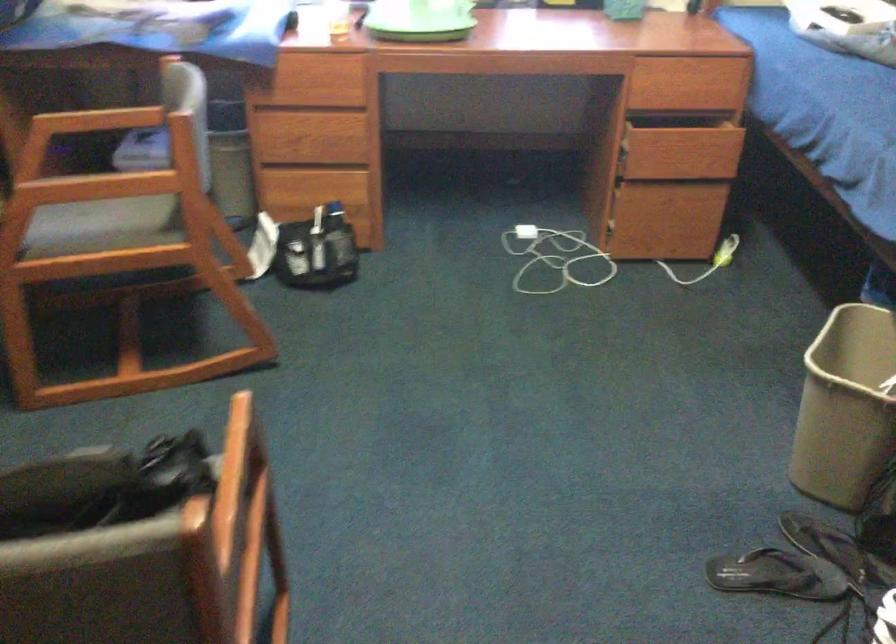
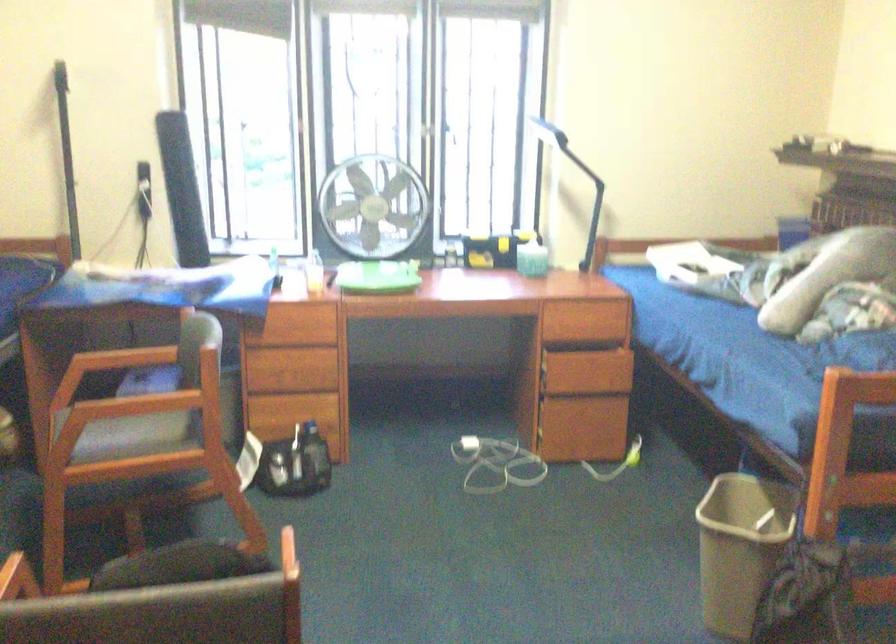
The point at (686, 216) is marked in the first image. Where is the corresponding point in the second image?

(599, 424)